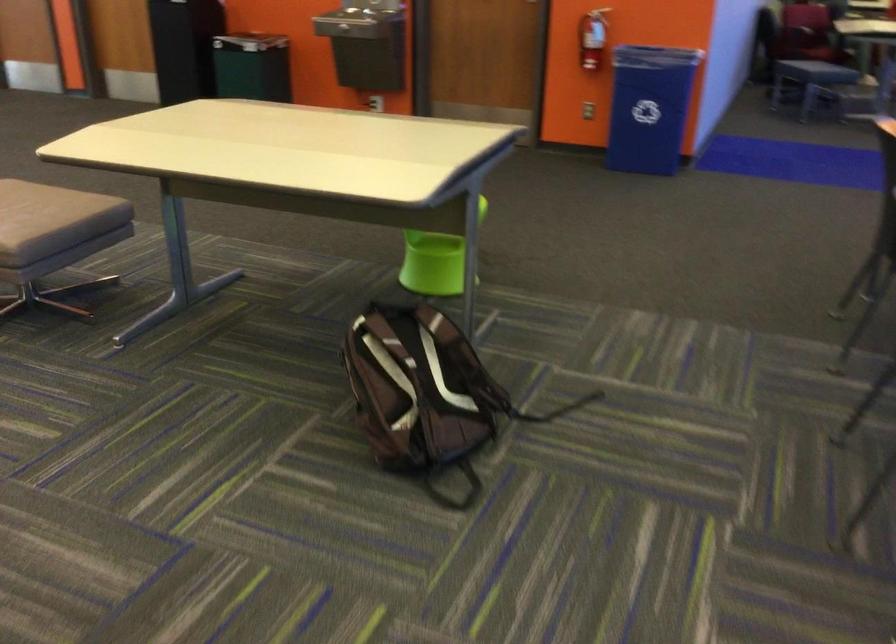
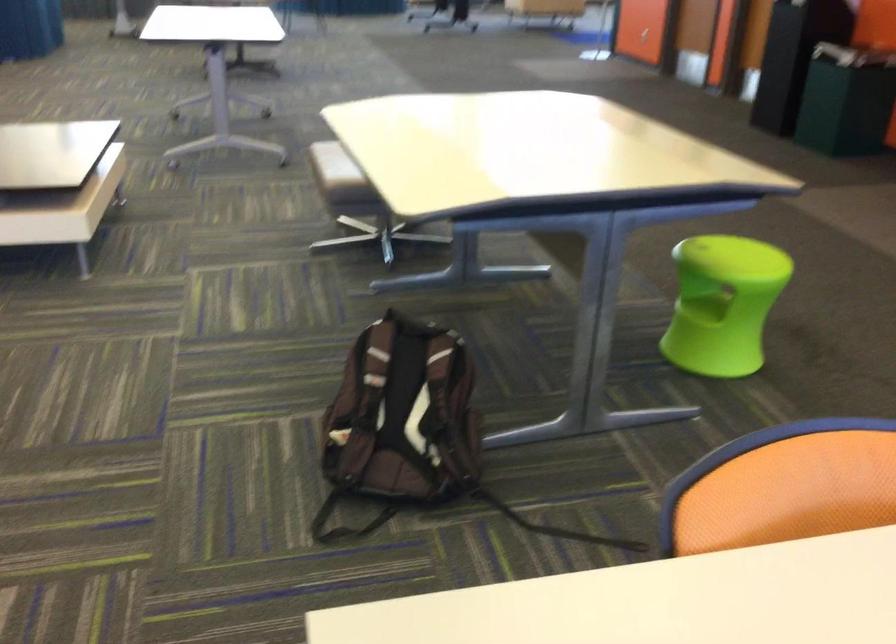
Find the pixel in the second image that matches pixel 429 383 in the first image.

(402, 413)